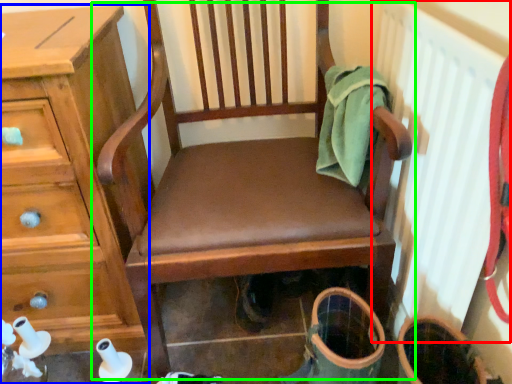
Question: Considering the real-world distances, which object is closest to radiator (highlighted by a red box)? chest of drawers (highlighted by a blue box) or chair (highlighted by a green box).

Choices:
 (A) chest of drawers
 (B) chair

Answer: (B)